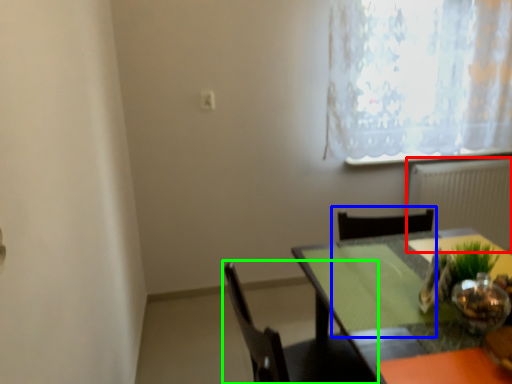
Question: Which object is positioned farthest from radiator (highlighted by a red box)? Select from chair (highlighted by a blue box) and chair (highlighted by a green box).

Choices:
 (A) chair
 (B) chair

Answer: (B)